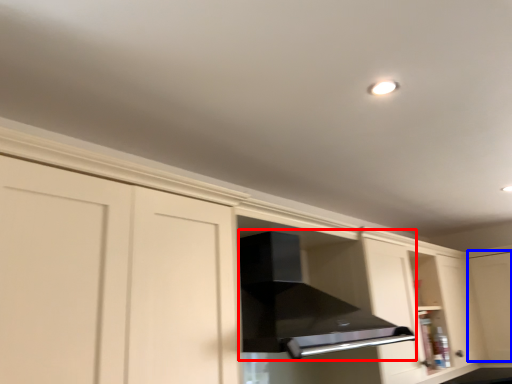
Question: Which point is closer to the camera, vent (highlighted by a red box) or glass door (highlighted by a blue box)?

Choices:
 (A) vent
 (B) glass door

Answer: (A)